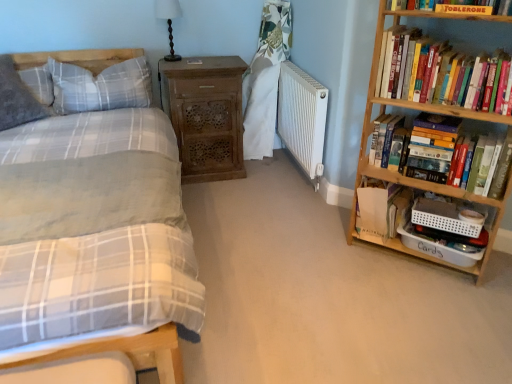
Identify the location of vacant space that's between wooden carved nightstand at left and white paper bag at right, which is counted as the third book, starting from the top. (271, 203).